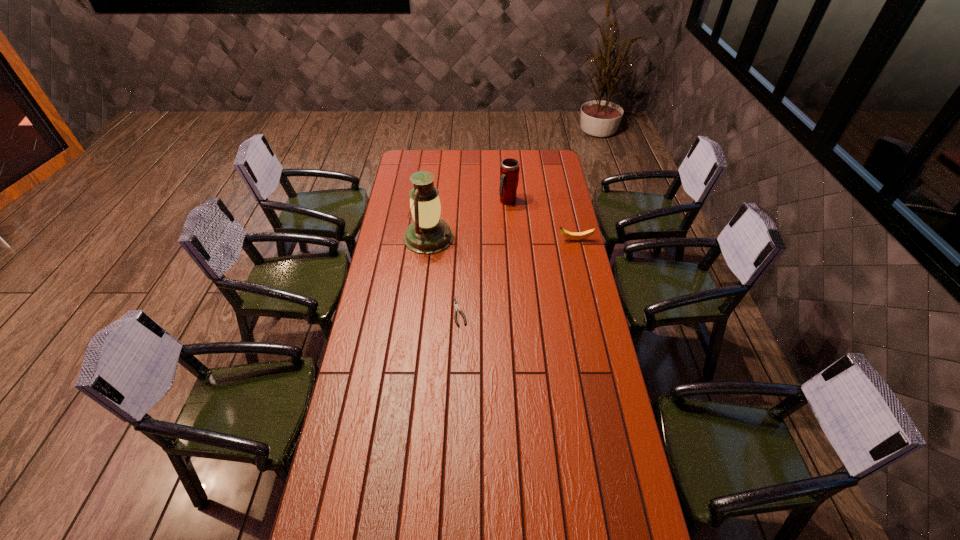
The image size is (960, 540). What are the coordinates of `empty space between the farthest object and the leftmost object` in the screenshot? It's located at (468, 219).

This screenshot has height=540, width=960. I want to click on empty space that is in between the third object from left to right and the banana, so click(x=541, y=221).

The width and height of the screenshot is (960, 540). I want to click on empty space between the nearest object and the leftmost object, so click(x=444, y=274).

Image resolution: width=960 pixels, height=540 pixels. Identify the location of free area in between the leftmost object and the nearest object. (444, 274).

The image size is (960, 540). In order to click on vacant area that lies between the banana and the lantern in this screenshot , I will do `click(502, 239)`.

Find the location of a particular element. object that is the third closest to the farthest object is located at coordinates (456, 306).

Where is `object that is the second closest to the thermos bottle`? This screenshot has width=960, height=540. object that is the second closest to the thermos bottle is located at coordinates (586, 234).

Where is `free spot that satisfies the following two spatial constraints: 1. on the back side of the farthest object; 2. on the right side of the lantern`? free spot that satisfies the following two spatial constraints: 1. on the back side of the farthest object; 2. on the right side of the lantern is located at coordinates (433, 201).

Find the location of a particular element. Image resolution: width=960 pixels, height=540 pixels. free region that satisfies the following two spatial constraints: 1. on the front side of the banana; 2. at the stem of the thermos bottle is located at coordinates (511, 240).

Find the location of a particular element. Image resolution: width=960 pixels, height=540 pixels. free space that satisfies the following two spatial constraints: 1. on the front side of the tallest object; 2. on the right side of the shortest object is located at coordinates tap(420, 312).